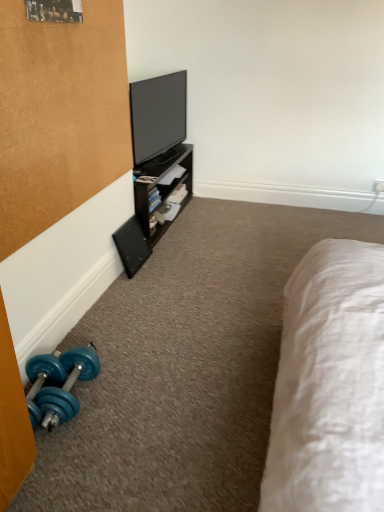
Locate an element on the screen. The width and height of the screenshot is (384, 512). vacant area on the back side of blue rubber dumbbell at lower left is located at coordinates (112, 342).